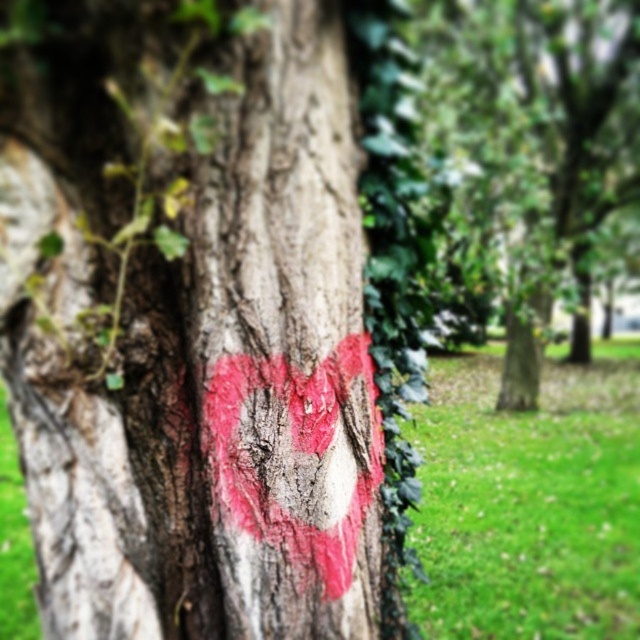
Question: Which point appears closest to the camera in this image?

Choices:
 (A) (176, 260)
 (B) (513, 58)

Answer: (A)

Question: Where is smooth bark heart at center located in relation to smooth bark tree at center in the image?

Choices:
 (A) below
 (B) above

Answer: (A)

Question: Is smooth bark heart at center further to camera compared to smooth bark tree at center?

Choices:
 (A) yes
 (B) no

Answer: (B)

Question: Does smooth bark heart at center lie behind smooth bark tree at center?

Choices:
 (A) yes
 (B) no

Answer: (B)

Question: Which object appears farthest from the camera in this image?

Choices:
 (A) smooth bark heart at center
 (B) smooth bark tree at center

Answer: (B)